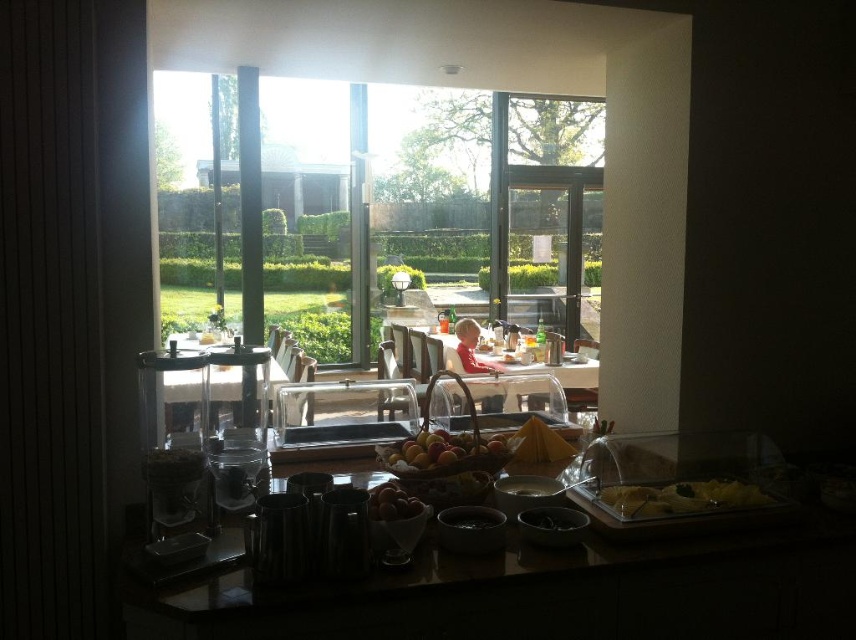
You are a guest at the breakfast buffet and want to exit through the transparent glass door at center. However, there is a yellow matte pasta at lower right nearby. Can you walk directly to the door without stepping over or moving the pasta?

The transparent glass door at center is above the yellow matte pasta at lower right, meaning the door is positioned higher up or in a location that is not directly blocking the path. Therefore, you can walk directly to the transparent glass door at center without needing to step over or move the yellow matte pasta at lower right.

You are a guest at the buffet and want to reach the smooth brown eggs at center. The transparent glass door at center is locked. Can you access the eggs without opening the door?

The smooth brown eggs at center is behind the transparent glass door at center, so you cannot access them without opening the door.